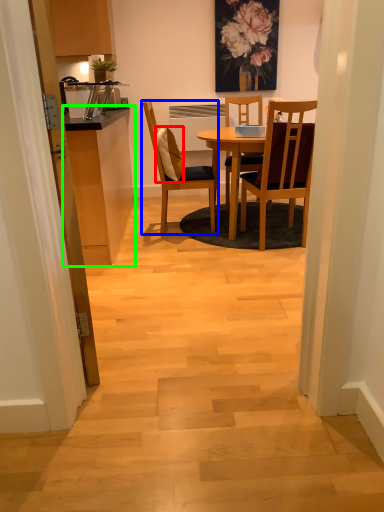
Question: Estimate the real-world distances between objects in this image. Which object is farther from pillow (highlighted by a red box), chair (highlighted by a blue box) or cabinetry (highlighted by a green box)?

Choices:
 (A) chair
 (B) cabinetry

Answer: (B)